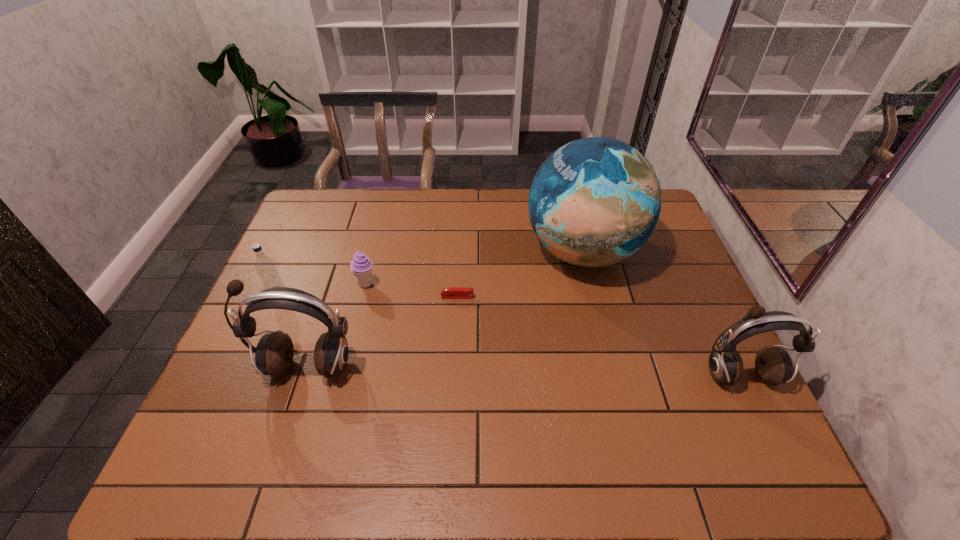
At what (x,y) coordinates should I click in order to perform the action: click on blank area in the image that satisfies the following two spatial constraints: 1. on the front side of the globe; 2. on the front-facing side of the stapler. Please return your answer as a coordinate pair (x, y). Looking at the image, I should click on (593, 297).

Identify the location of free space that satisfies the following two spatial constraints: 1. on the front-facing side of the stapler; 2. on the ear pads of the taller earphone. (454, 367).